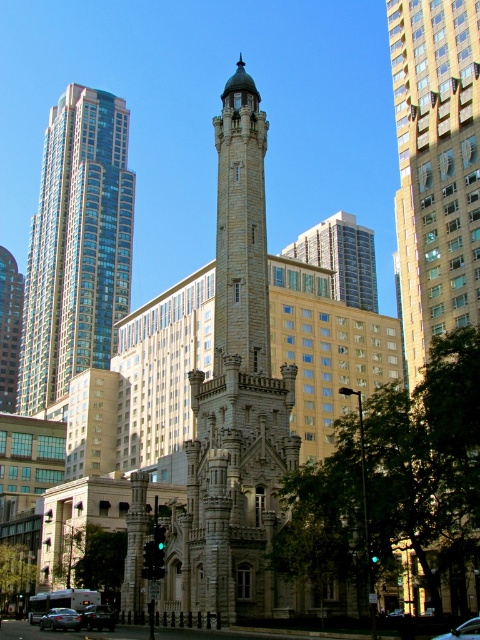
You are standing in the city square and see the stone tower at center and the silver metallic building at center. Which one is positioned to the left?

The stone tower at center is positioned to the left of the silver metallic building at center.